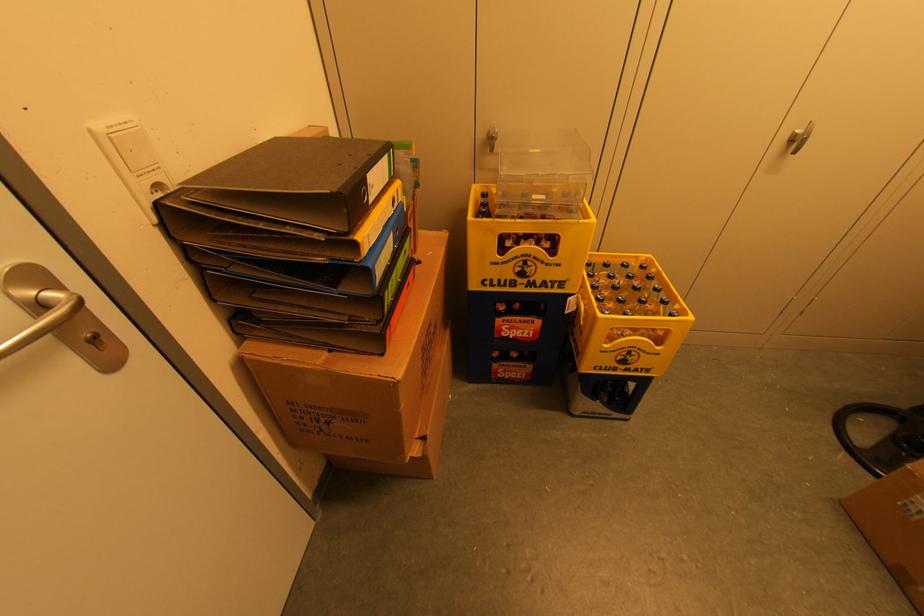
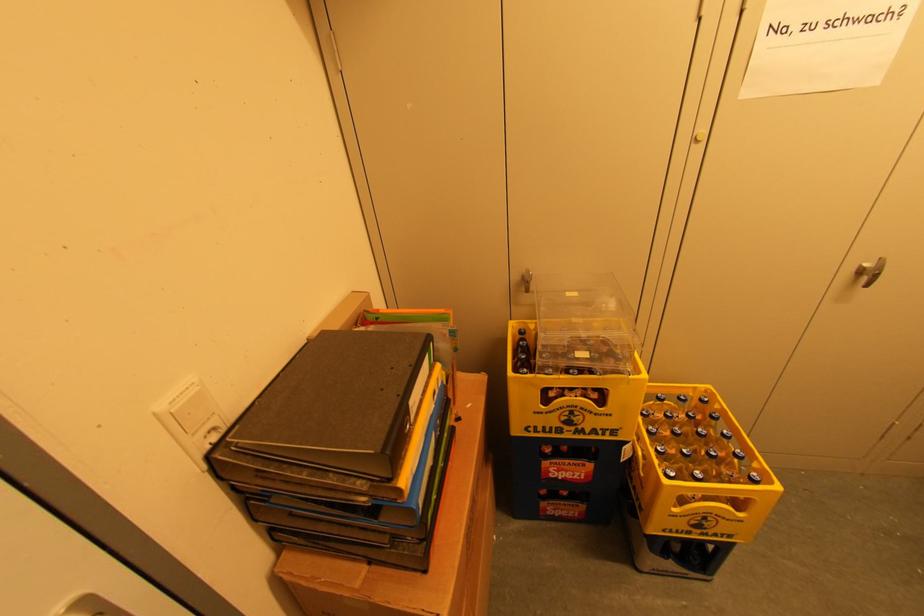
In the second image, find the point that corresponds to the point at 487,196 in the first image.

(525, 333)